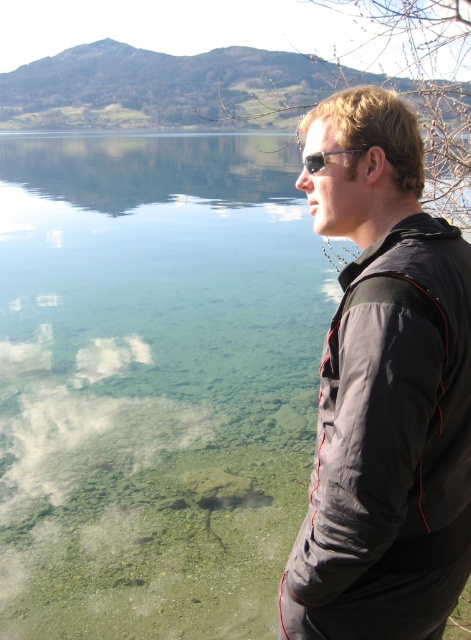
Question: Which point is farther to the camera?

Choices:
 (A) sunglasses at center
 (B) dark gray jacket at right

Answer: (A)

Question: Is dark gray jacket at right behind sunglasses at center?

Choices:
 (A) no
 (B) yes

Answer: (A)

Question: Is dark gray jacket at right bigger than sunglasses at center?

Choices:
 (A) no
 (B) yes

Answer: (B)

Question: Which object is closer to the camera taking this photo?

Choices:
 (A) sunglasses at center
 (B) dark gray jacket at right

Answer: (B)

Question: Is dark gray jacket at right further to the viewer compared to sunglasses at center?

Choices:
 (A) no
 (B) yes

Answer: (A)